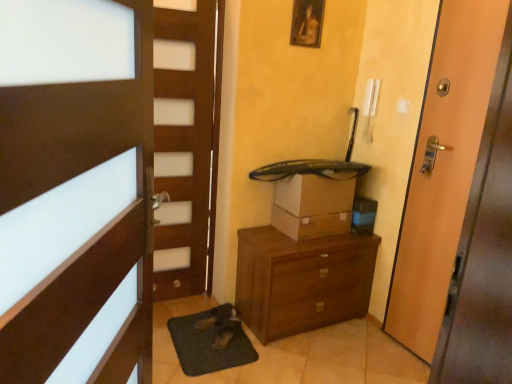
Where is `empty space that is ontop of brown wooden chest of drawers at center (from a real-world perspective)`? empty space that is ontop of brown wooden chest of drawers at center (from a real-world perspective) is located at coordinates pyautogui.click(x=292, y=239).